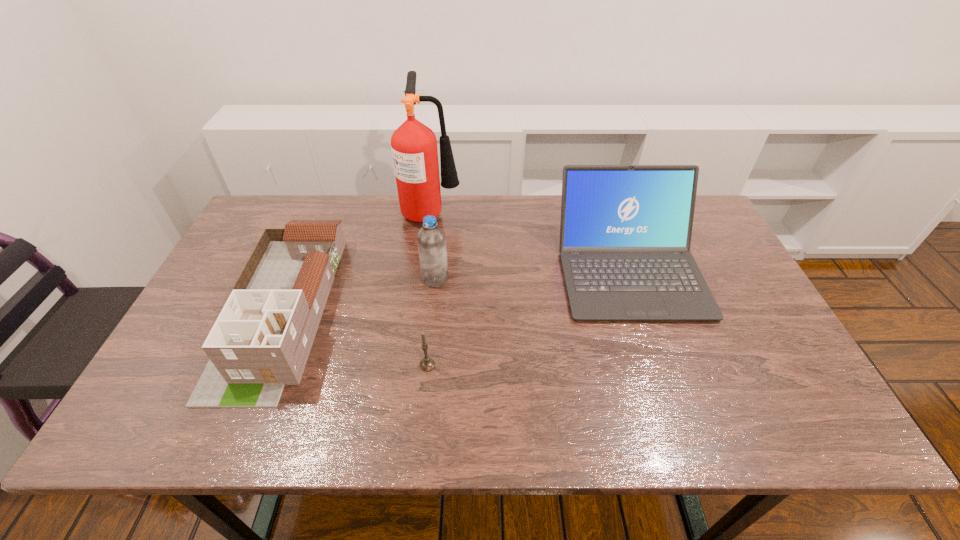
This screenshot has width=960, height=540. Identify the location of the tallest object. (414, 149).

Identify the location of laptop computer. This screenshot has height=540, width=960. (625, 233).

This screenshot has width=960, height=540. I want to click on water bottle, so click(431, 239).

Find the location of a particular element. This screenshot has height=540, width=960. the second shortest object is located at coordinates (261, 340).

You are a GUI agent. You are given a task and a screenshot of the screen. Output one action in this format:
    pyautogui.click(x=<x>, y=<y>)
    Task: Click on the leftmost object
    
    Given the screenshot: What is the action you would take?
    pyautogui.click(x=261, y=340)

Where is `the shortest object`? The height and width of the screenshot is (540, 960). the shortest object is located at coordinates (427, 364).

I want to click on free region located 0.290m at the nozzle of the fire extinguisher, so click(x=547, y=211).

The height and width of the screenshot is (540, 960). I want to click on free space located on the screen of the rightmost object, so click(671, 392).

Identify the location of blank space located 0.360m on the back of the water bottle. The width and height of the screenshot is (960, 540). (444, 198).

The width and height of the screenshot is (960, 540). Find the location of `free location located at the main entrance of the fourth tallest object`. free location located at the main entrance of the fourth tallest object is located at coordinates (228, 434).